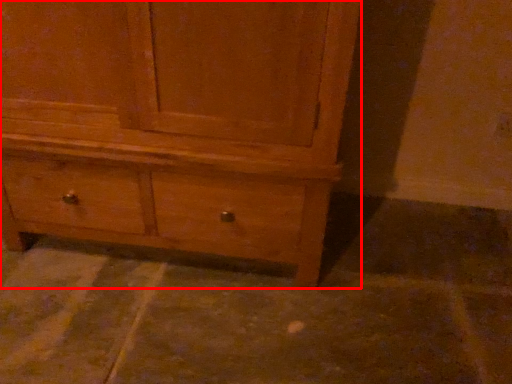
Question: In this image, where is chest of drawers (annotated by the red box) located relative to concrete?

Choices:
 (A) left
 (B) right

Answer: (A)